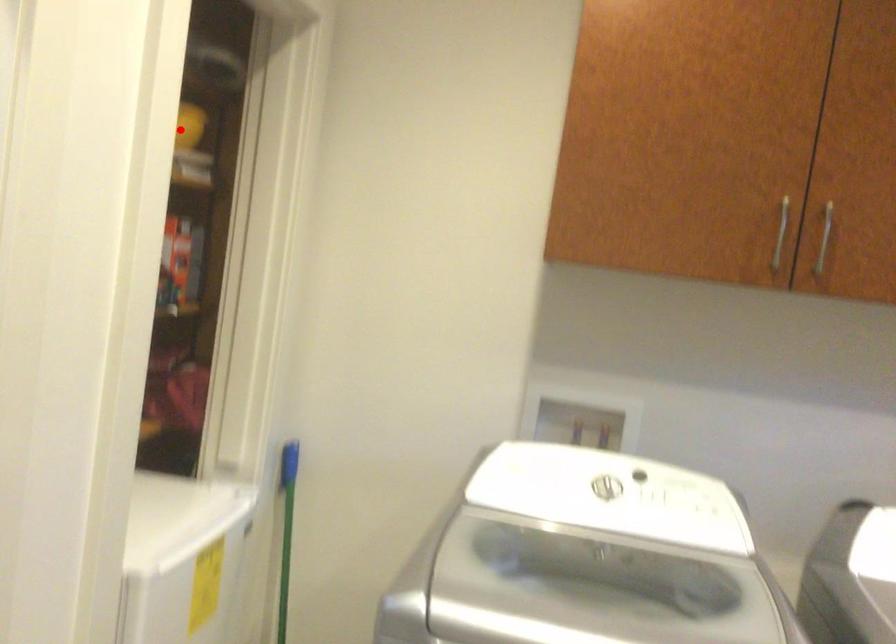
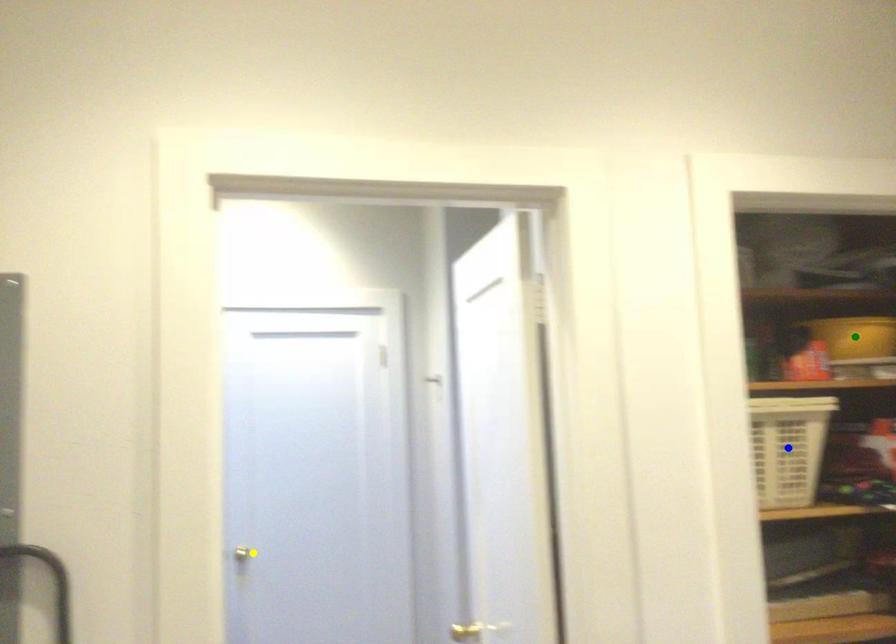
Question: I am providing you with two images of the same scene from different viewpoints. A red point is marked on the first image. You are given multiple points on the second image. Which spot in image 2 lines up with the point in image 1?

Choices:
 (A) yellow point
 (B) blue point
 (C) green point

Answer: (C)